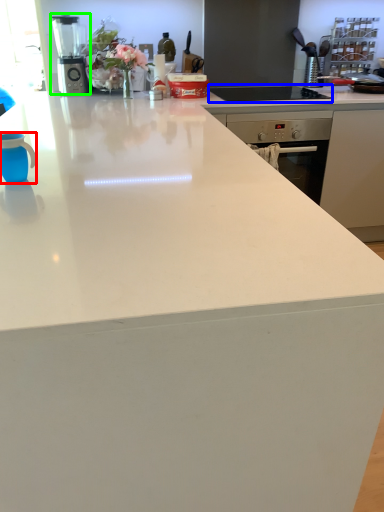
Question: Based on their relative distances, which object is nearer to mug (highlighted by a red box)? Choose from gas stove (highlighted by a blue box) and kitchen appliance (highlighted by a green box).

Choices:
 (A) gas stove
 (B) kitchen appliance

Answer: (A)